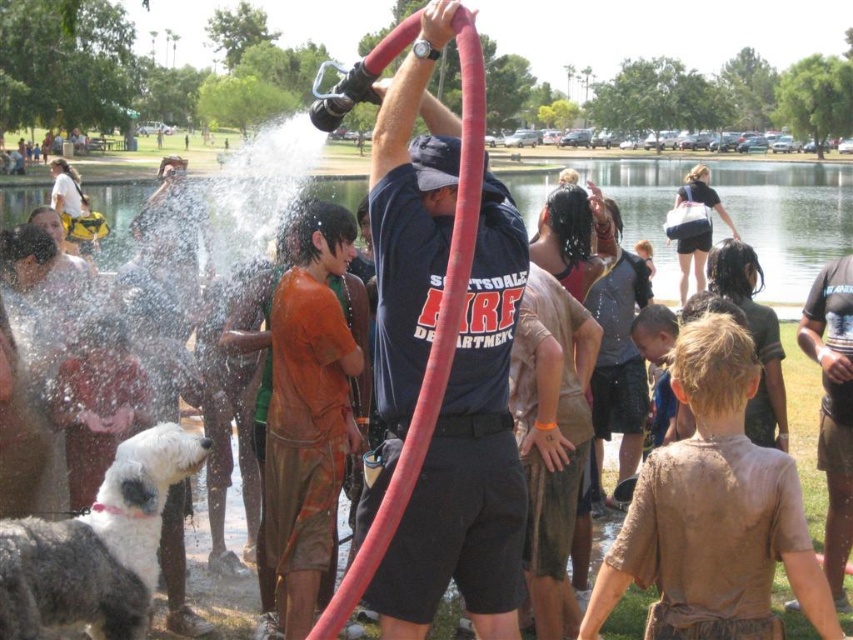
Question: Estimate the real-world distances between objects in this image. Which object is closer to the white foam water at center?

Choices:
 (A) rubber hose at center
 (B) dark brown t-shirt at right

Answer: (A)

Question: Does white foam water at center appear on the left side of rubber hose at center?

Choices:
 (A) yes
 (B) no

Answer: (B)

Question: Where is white foam water at center located in relation to rubber hose at center in the image?

Choices:
 (A) below
 (B) above

Answer: (A)

Question: Among these points, which one is farthest from the camera?

Choices:
 (A) (279, 193)
 (B) (817, 337)
 (C) (456, 280)

Answer: (A)

Question: Is white foam water at center positioned behind rubber hose at center?

Choices:
 (A) no
 (B) yes

Answer: (B)

Question: Estimate the real-world distances between objects in this image. Which object is farther from the rubber hose at center?

Choices:
 (A) white foam water at center
 (B) dark brown t-shirt at right

Answer: (A)